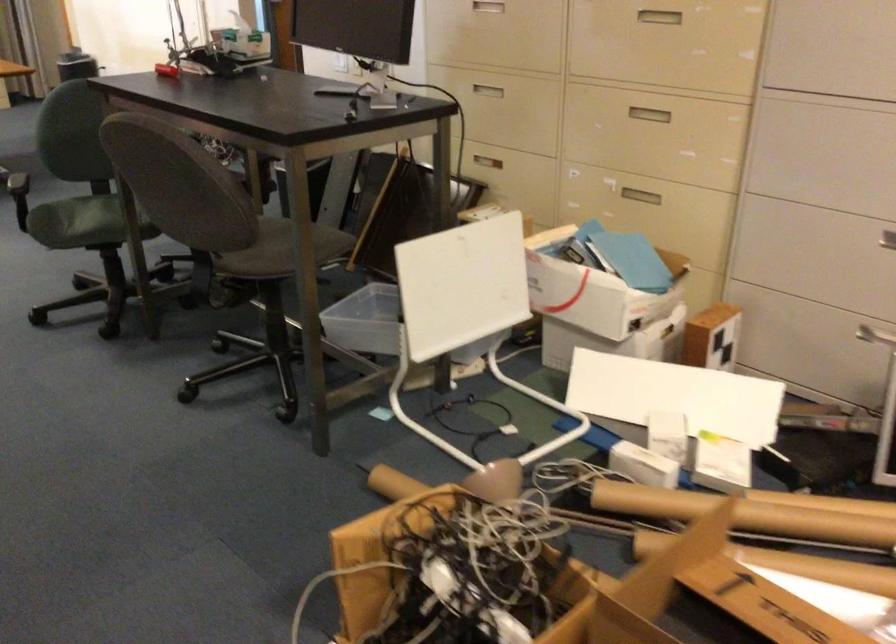
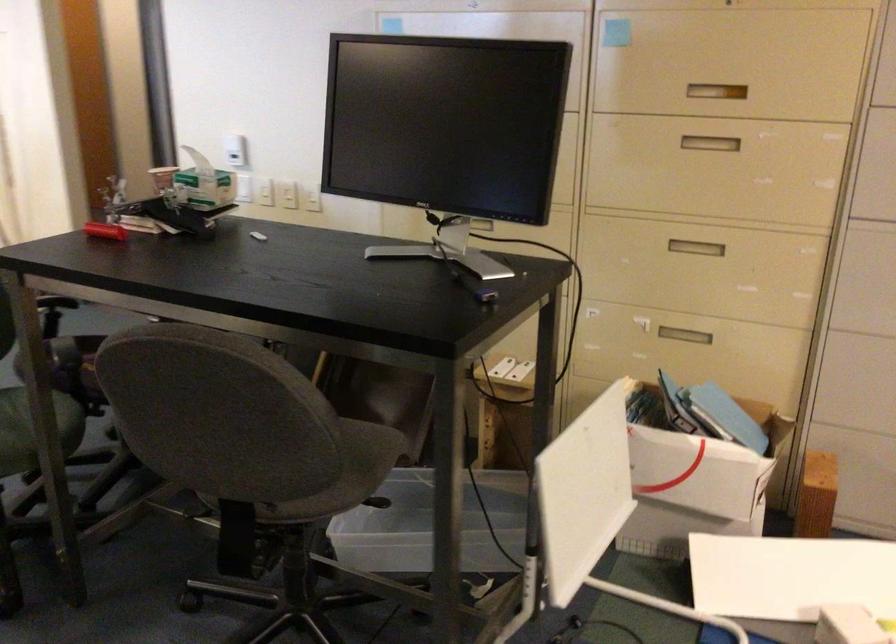
Find the pixel in the second image that matches [582,303] in the first image.

(694, 484)